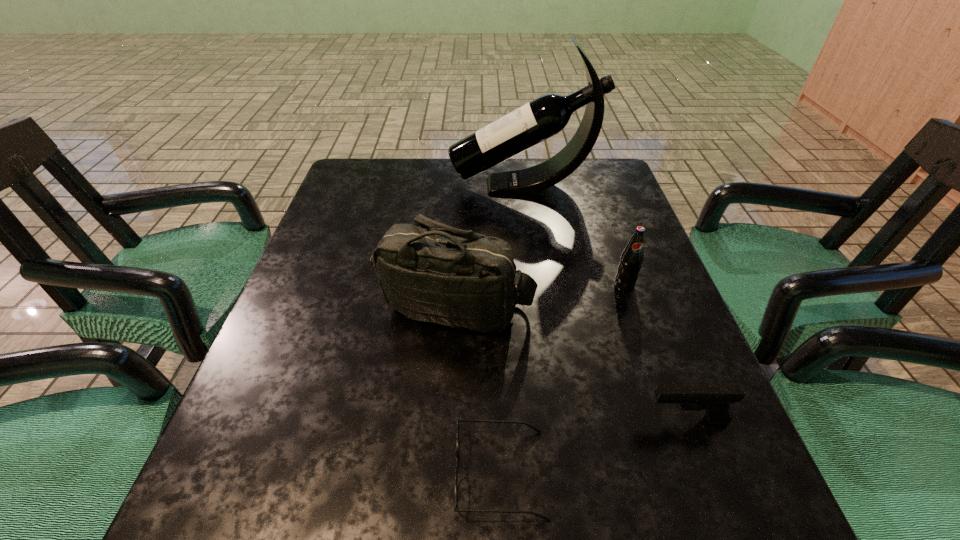
Where is `vacant space positioned 0.180m on the stand of the farthest object`? vacant space positioned 0.180m on the stand of the farthest object is located at coordinates (386, 186).

The image size is (960, 540). Identify the location of vacant point located 0.110m at the front padded panel of the second tallest object. (451, 394).

At what (x,y) coordinates should I click in order to perform the action: click on free spot located 0.300m on the front label of the pop. Please return your answer as a coordinate pair (x, y). This screenshot has height=540, width=960. Looking at the image, I should click on (671, 426).

This screenshot has height=540, width=960. Find the location of `free point located on the front-facing side of the fourth tallest object`. free point located on the front-facing side of the fourth tallest object is located at coordinates (488, 420).

At what (x,y) coordinates should I click in order to perform the action: click on vacant space located 0.190m on the front-facing side of the fourth tallest object. Please return your answer as a coordinate pair (x, y). Looking at the image, I should click on (525, 420).

In order to click on free region located on the front-facing side of the fourth tallest object in this screenshot , I will do `click(587, 420)`.

Locate an element on the screen. free space located 0.350m on the front-facing side of the spectacles is located at coordinates (219, 474).

You are a GUI agent. You are given a task and a screenshot of the screen. Output one action in this format:
    pyautogui.click(x=<x>, y=<y>)
    Task: Click on the blank area located 0.060m on the front-facing side of the spectacles
    
    Given the screenshot: What is the action you would take?
    pyautogui.click(x=416, y=474)

You are a GUI agent. You are given a task and a screenshot of the screen. Output one action in this format:
    pyautogui.click(x=<x>, y=<y>)
    Task: Click on the vacant space located 0.280m on the front-facing side of the spectacles
    
    Given the screenshot: What is the action you would take?
    click(266, 474)

Identify the location of object that is at the far edge. (547, 115).